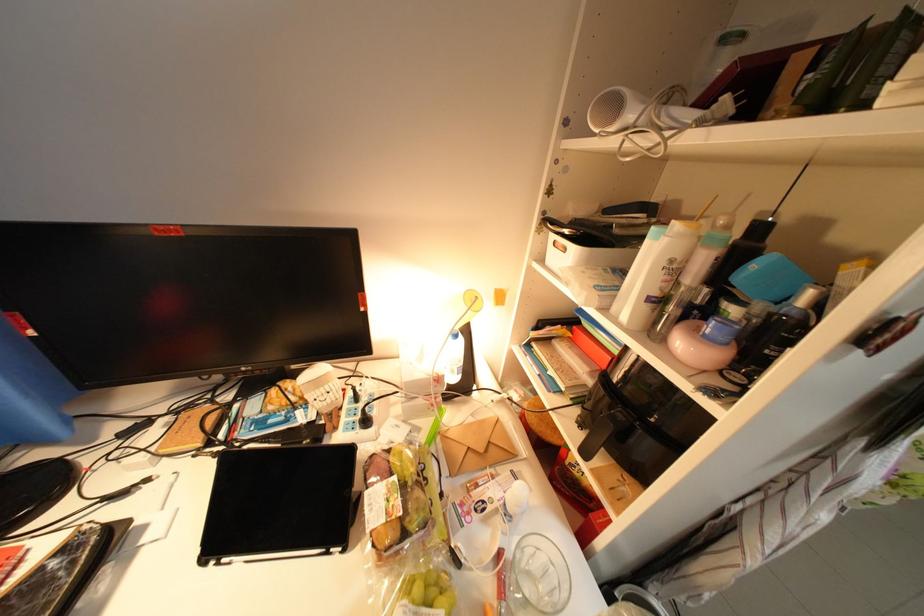
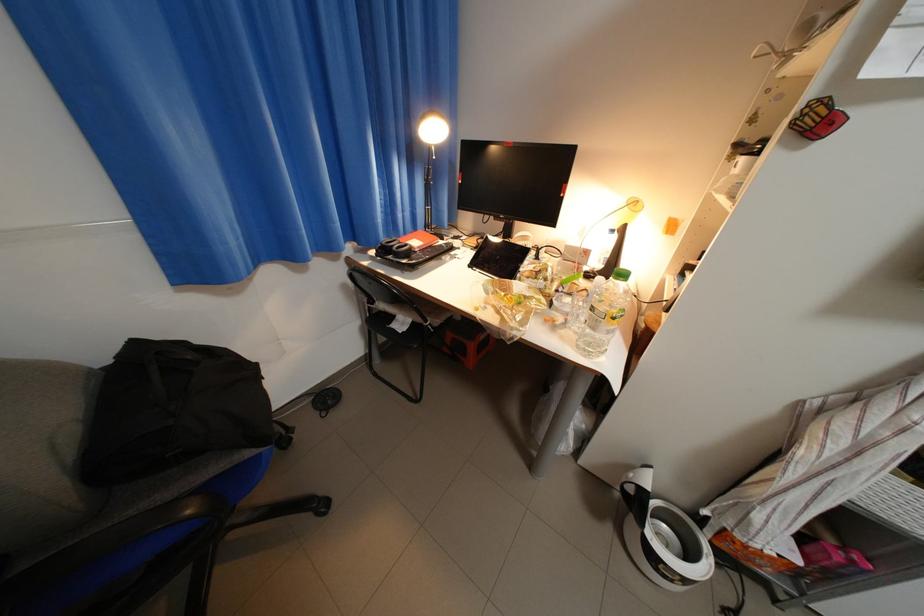
Question: The images are taken continuously from a first-person perspective. In which direction is your viewpoint rotating?

Choices:
 (A) Left
 (B) Right
 (C) Up
 (D) Down

Answer: (A)